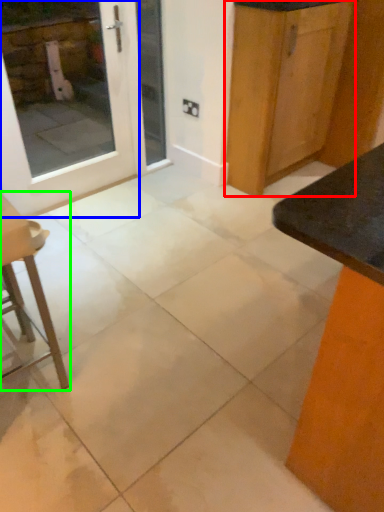
Question: Which object is positioned farthest from cabinetry (highlighted by a red box)? Select from door (highlighted by a blue box) and furniture (highlighted by a green box).

Choices:
 (A) door
 (B) furniture

Answer: (B)